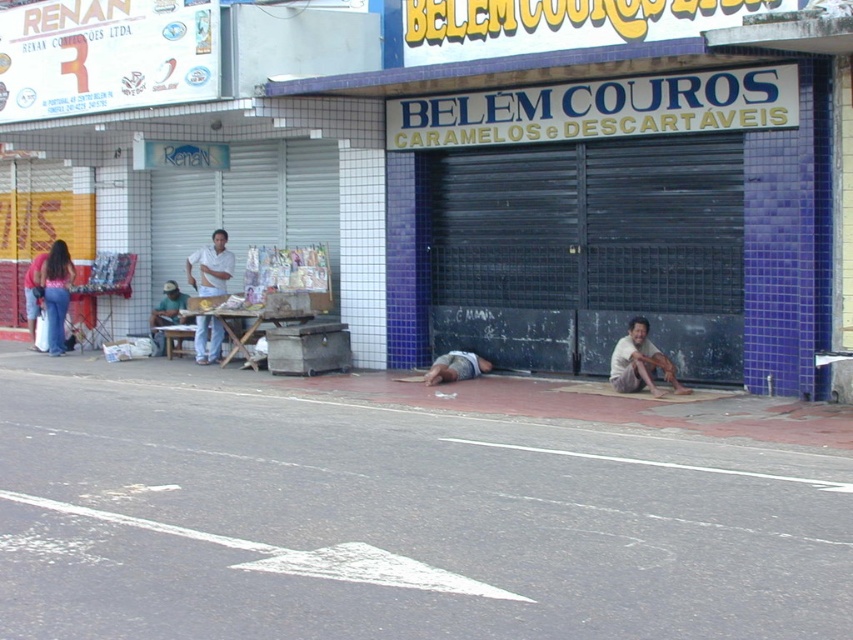
Question: Which point appears closest to the camera in this image?

Choices:
 (A) (437, 362)
 (B) (614, 380)
 (C) (39, 256)

Answer: (B)

Question: Which point is closer to the camera?

Choices:
 (A) blue tile storefront at center
 (B) light brown wooden table at center-left

Answer: (A)

Question: Is light brown wooden table at center-left positioned at the back of jeans at left?

Choices:
 (A) yes
 (B) no

Answer: (A)

Question: Can you confirm if black metal/gate at center is positioned to the right of denim pants at left?

Choices:
 (A) no
 (B) yes

Answer: (B)

Question: Which object appears farthest from the camera in this image?

Choices:
 (A) light brown skin at lower right
 (B) jeans at left

Answer: (B)

Question: Is black metal/gate at center in front of light brown skin at lower right?

Choices:
 (A) no
 (B) yes

Answer: (A)